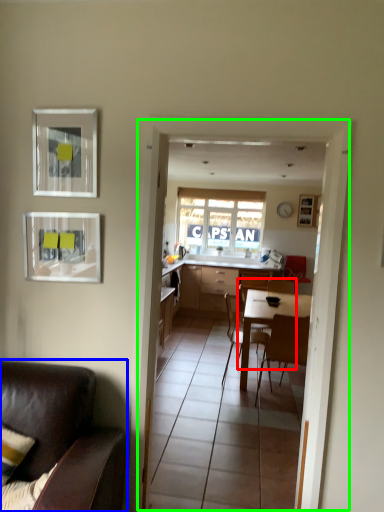
Question: Considering the real-world distances, which object is closest to chair (highlighted by a red box)? chair (highlighted by a blue box) or glass door (highlighted by a green box).

Choices:
 (A) chair
 (B) glass door

Answer: (B)